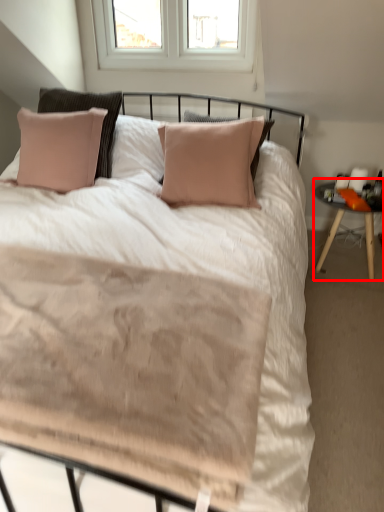
Question: From the image's perspective, considering the relative positions of nightstand (annotated by the red box) and bed in the image provided, where is nightstand (annotated by the red box) located with respect to the staircase?

Choices:
 (A) above
 (B) below

Answer: (A)